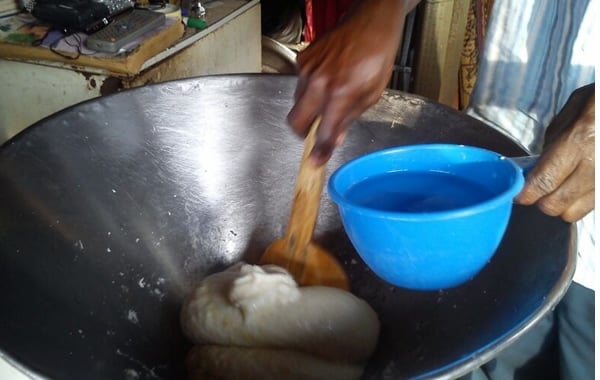
Identify the location of silver tv remote. (120, 36).